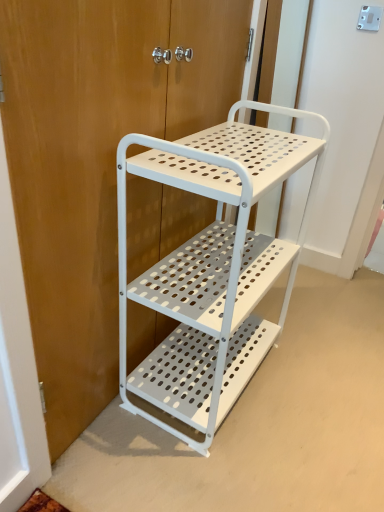
Question: Is white perforated metal cart at center bigger or smaller than white metal door at center?

Choices:
 (A) big
 (B) small

Answer: (A)

Question: Is white perforated metal cart at center in front of or behind white metal door at center in the image?

Choices:
 (A) front
 (B) behind

Answer: (B)

Question: From their relative heights in the image, would you say white perforated metal cart at center is taller or shorter than white metal door at center?

Choices:
 (A) short
 (B) tall

Answer: (A)

Question: From a real-world perspective, relative to white perforated metal cart at center, is white metal door at center vertically above or below?

Choices:
 (A) above
 (B) below

Answer: (A)

Question: From the image's perspective, is white metal door at center positioned above or below white perforated metal cart at center?

Choices:
 (A) below
 (B) above

Answer: (B)

Question: Would you say white metal door at center is to the left or to the right of white perforated metal cart at center in the picture?

Choices:
 (A) left
 (B) right

Answer: (A)

Question: Considering the positions of point (135, 3) and point (220, 420), is point (135, 3) closer or farther from the camera than point (220, 420)?

Choices:
 (A) closer
 (B) farther

Answer: (A)